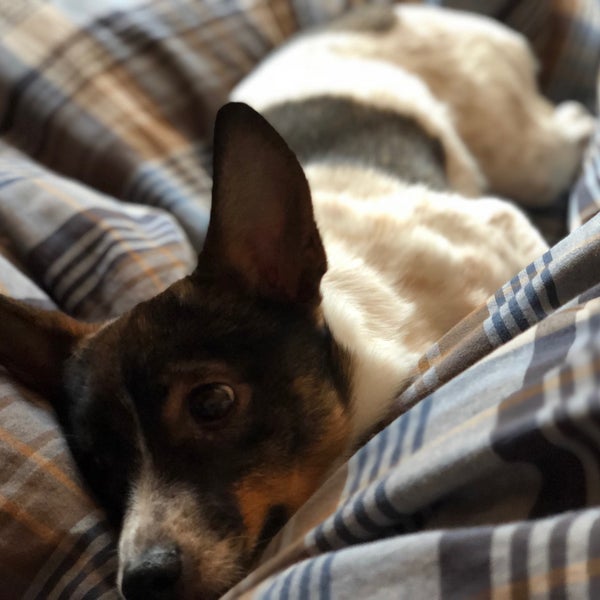
Find the location of a particular element. left front leg is located at coordinates (451, 225).